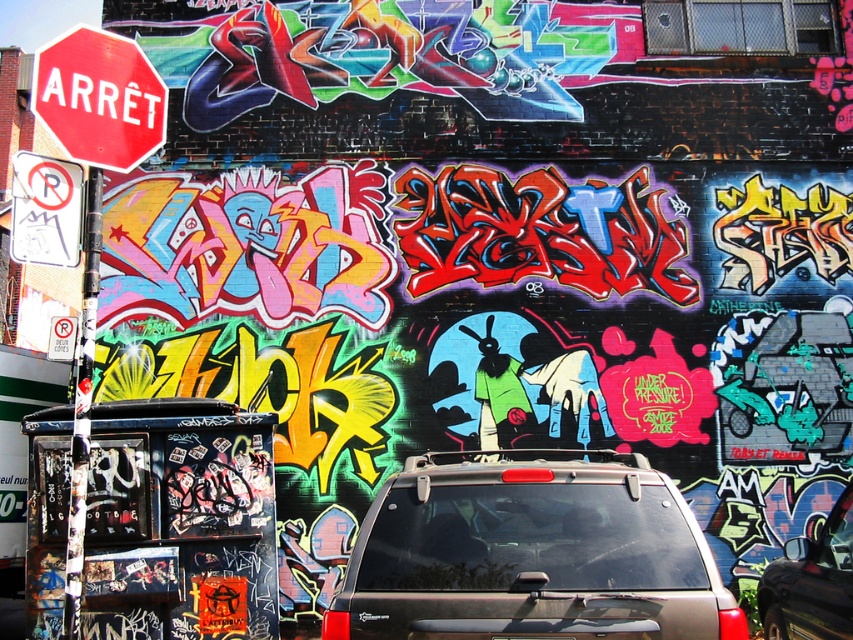
Question: Which point appears closest to the camera in this image?

Choices:
 (A) (775, 560)
 (B) (96, 44)
 (C) (374, 582)

Answer: (C)

Question: In this image, where is matte red stop sign at upper left located relative to white paper no parking sign at left?

Choices:
 (A) left
 (B) right

Answer: (B)

Question: Which object appears farthest from the camera in this image?

Choices:
 (A) metallic silver minivan at center
 (B) matte red stop sign at upper left
 (C) white paper no parking sign at left

Answer: (C)

Question: Among these points, which one is farthest from the camera?

Choices:
 (A) (561, 513)
 (B) (848, 496)
 (C) (30, 186)

Answer: (B)

Question: Does black matte car at lower right appear on the right side of white paper no parking sign at left?

Choices:
 (A) yes
 (B) no

Answer: (A)

Question: Does metallic silver minivan at center have a smaller size compared to matte red stop sign at upper left?

Choices:
 (A) no
 (B) yes

Answer: (A)